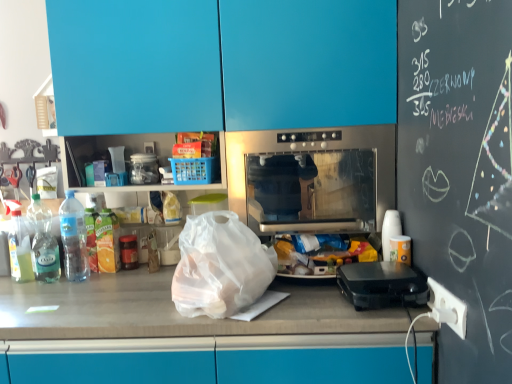
Question: Considering the relative positions of blue glossy cabinets at upper center and clear plastic bottle at left, the 2th bottle when ordered from right to left, in the image provided, is blue glossy cabinets at upper center in front of clear plastic bottle at left, the 2th bottle when ordered from right to left,?

Choices:
 (A) no
 (B) yes

Answer: (B)

Question: Is blue glossy cabinets at upper center far from clear plastic bottle at left, acting as the 2th bottle starting from the left?

Choices:
 (A) yes
 (B) no

Answer: (B)

Question: From a real-world perspective, is blue glossy cabinets at upper center located beneath clear plastic bottle at left, acting as the 2th bottle starting from the left?

Choices:
 (A) no
 (B) yes

Answer: (A)

Question: Is blue glossy cabinets at upper center behind clear plastic bottle at left, the 2th bottle when ordered from right to left?

Choices:
 (A) no
 (B) yes

Answer: (A)

Question: Could you tell me if blue glossy cabinets at upper center is facing clear plastic bottle at left, the 2th bottle when ordered from right to left?

Choices:
 (A) yes
 (B) no

Answer: (B)

Question: Could clear plastic bottle at left, acting as the 2th bottle starting from the left, be considered to be inside blue glossy cabinets at upper center?

Choices:
 (A) no
 (B) yes

Answer: (A)

Question: From a real-world perspective, does black plastic waffle maker at right sit lower than stainless steel oven at center?

Choices:
 (A) yes
 (B) no

Answer: (A)

Question: Is black plastic waffle maker at right shorter than stainless steel oven at center?

Choices:
 (A) no
 (B) yes

Answer: (B)

Question: Is black plastic waffle maker at right positioned beyond the bounds of stainless steel oven at center?

Choices:
 (A) no
 (B) yes

Answer: (B)

Question: Is black plastic waffle maker at right at the left side of stainless steel oven at center?

Choices:
 (A) yes
 (B) no

Answer: (B)

Question: Can you confirm if black plastic waffle maker at right is smaller than stainless steel oven at center?

Choices:
 (A) yes
 (B) no

Answer: (A)

Question: From the image's perspective, would you say black plastic waffle maker at right is shown under stainless steel oven at center?

Choices:
 (A) no
 (B) yes

Answer: (B)

Question: Is blue glossy cabinets at upper center outside of black plastic waffle maker at right?

Choices:
 (A) yes
 (B) no

Answer: (A)